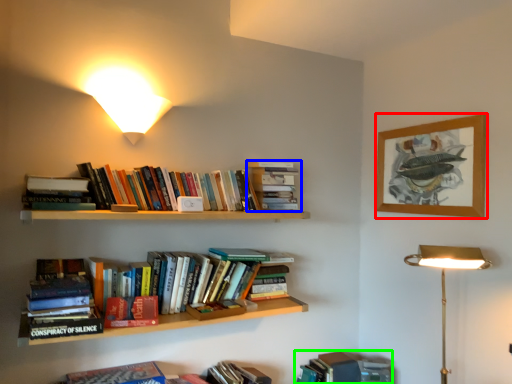
Question: Which object is positioned farthest from picture frame (highlighted by a red box)? Select from book (highlighted by a blue box) and book (highlighted by a green box).

Choices:
 (A) book
 (B) book

Answer: (B)